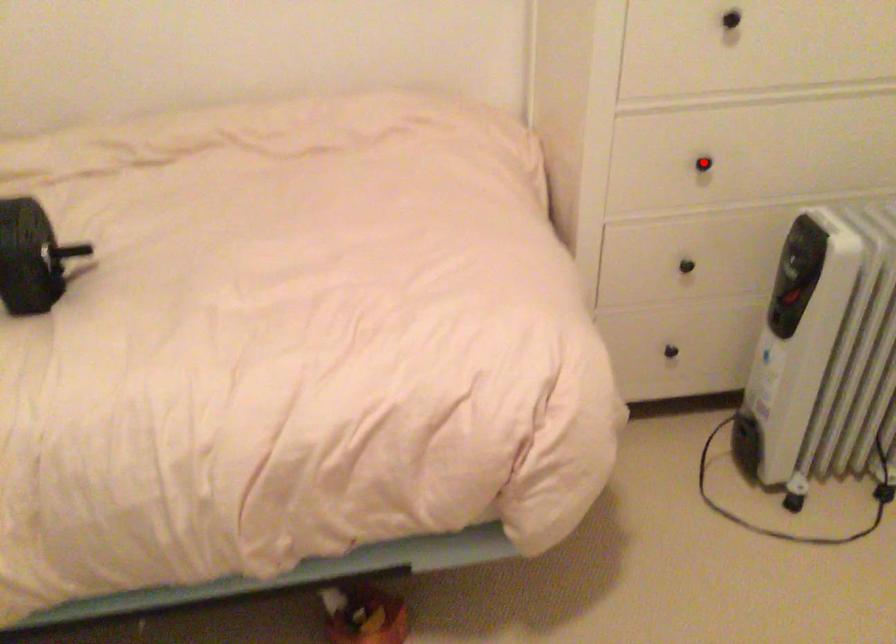
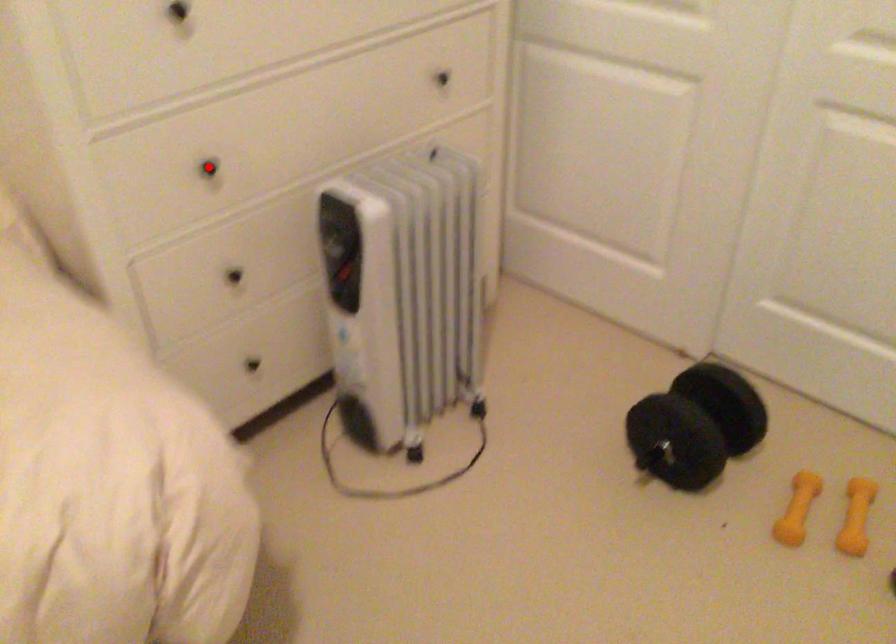
I am providing you with two images of the same scene from different viewpoints. A red point is marked on the first image and another point is marked on the second image. Do the highlighted points in image1 and image2 indicate the same real-world spot?

Yes